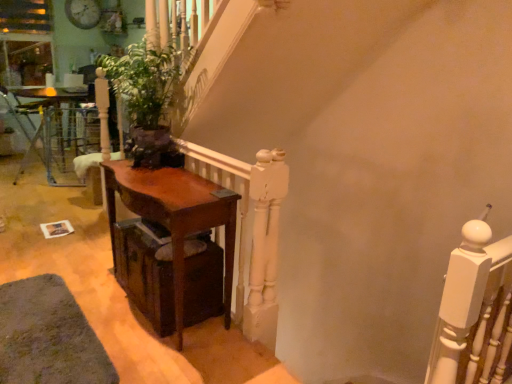
The width and height of the screenshot is (512, 384). In order to click on free space in front of mahogany wood table at center, the second table positioned from the top in this screenshot , I will do `click(158, 352)`.